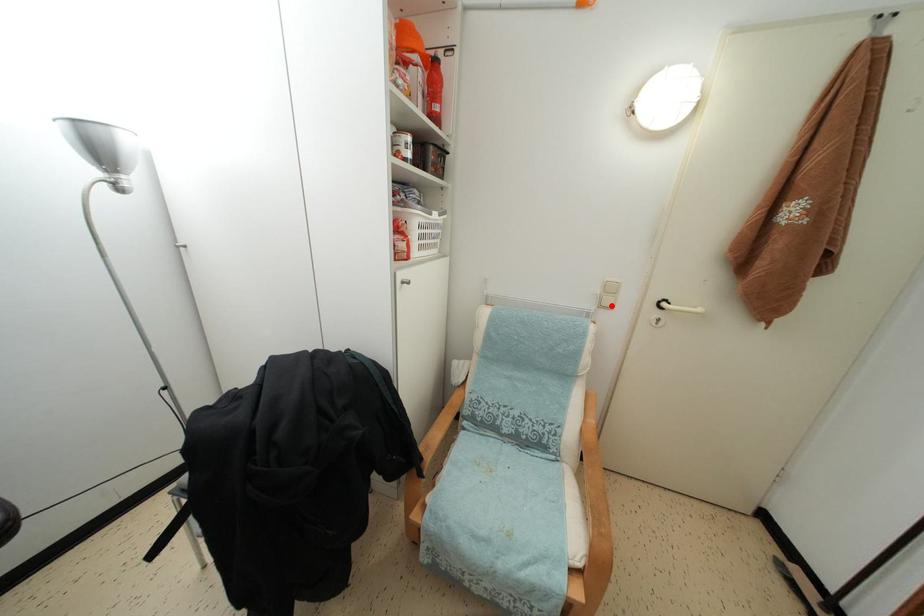
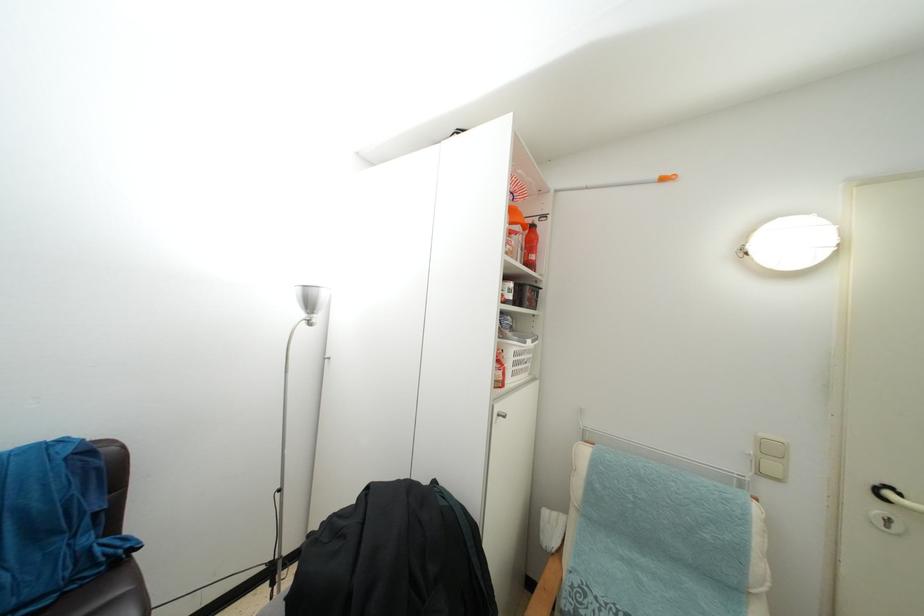
Find the pixel in the second image that matches the highlighted location in the first image.

(775, 472)